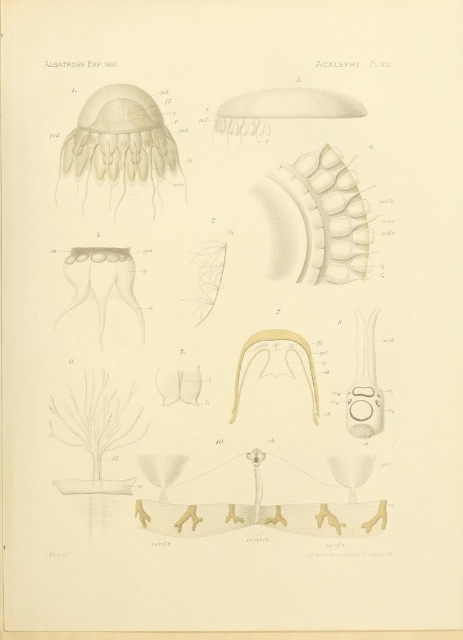
In the scientific illustration labeled Acalephs Pl. XIV from the Albatross Exp 1831 series, there are two points marked at coordinates point (93, 122) and point (301, 193). Which of these two points is positioned closer to the viewer?

Point (93, 122) is closer to the camera than point (301, 193).

Based on the illustration labeled as Acalephs Pl. XIV from the Albatross Exp 1831 series, where is the translucent beige jellyfish at upper left located in terms of coordinates?

The translucent beige jellyfish at upper left is located at coordinates point (119,141).

You are examining the scientific illustration and notice two jellyfish figures. The translucent beige jellyfish at upper left and the translucent yellow jellyfish at center. Which one appears closer to you?

The translucent beige jellyfish at upper left appears closer to you because it is positioned closer to the viewer than the translucent yellow jellyfish at center.